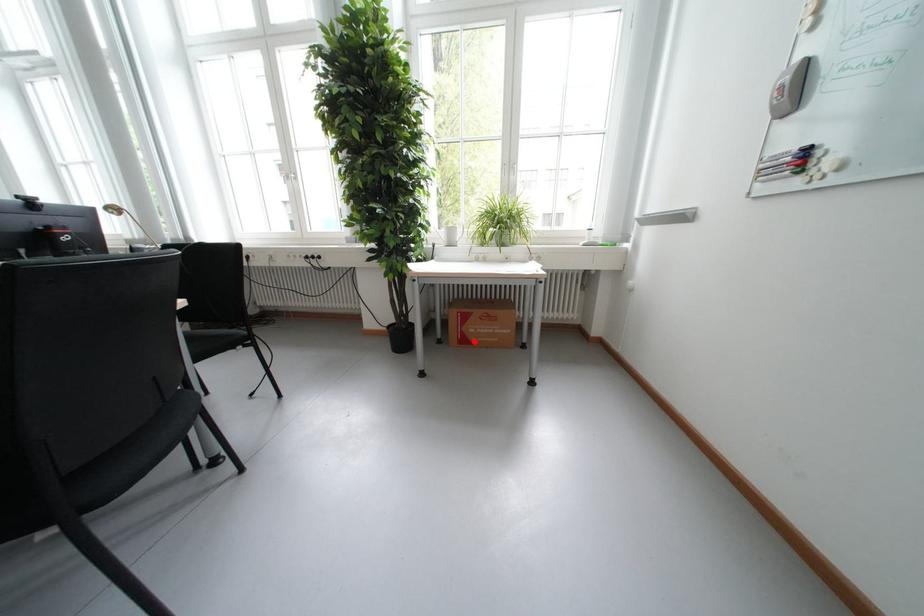
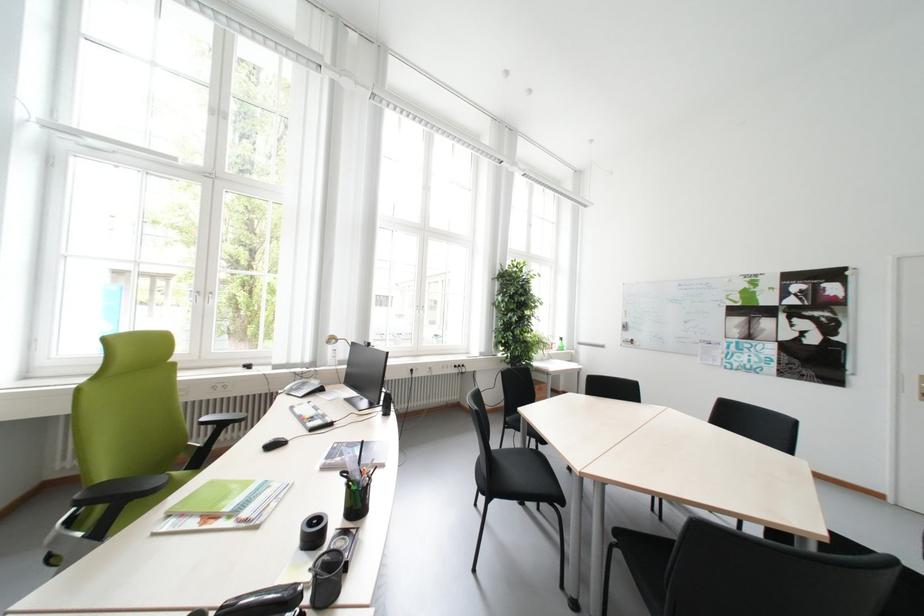
Question: I am providing you with two images of the same scene from different viewpoints. A red point is marked on the first image. Is the red point's position out of view in image 2?

Choices:
 (A) Yes
 (B) No

Answer: (A)